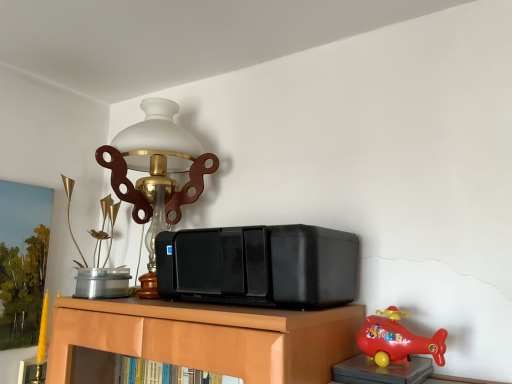
Question: Does black plastic stereo at center appear on the right side of rubberized red helicopter at lower right, the first toy when ordered from front to back?

Choices:
 (A) no
 (B) yes

Answer: (A)

Question: Is the depth of black plastic stereo at center greater than that of rubberized red helicopter at lower right, the second toy viewed from the left?

Choices:
 (A) no
 (B) yes

Answer: (B)

Question: Considering the relative sizes of black plastic stereo at center and rubberized red helicopter at lower right, the first toy when ordered from front to back, in the image provided, is black plastic stereo at center bigger than rubberized red helicopter at lower right, the first toy when ordered from front to back,?

Choices:
 (A) yes
 (B) no

Answer: (A)

Question: Would you consider black plastic stereo at center to be distant from rubberized red helicopter at lower right, the second toy viewed from the back?

Choices:
 (A) yes
 (B) no

Answer: (B)

Question: Is black plastic stereo at center directly adjacent to rubberized red helicopter at lower right, arranged as the 1th toy when viewed from the right?

Choices:
 (A) no
 (B) yes

Answer: (A)

Question: Is black plastic stereo at center in front of or behind matte brass lamp at upper left in the image?

Choices:
 (A) front
 (B) behind

Answer: (A)

Question: Visually, is black plastic stereo at center positioned to the left or to the right of matte brass lamp at upper left?

Choices:
 (A) left
 (B) right

Answer: (B)

Question: From the image's perspective, is black plastic stereo at center positioned above or below matte brass lamp at upper left?

Choices:
 (A) below
 (B) above

Answer: (A)

Question: In terms of size, does black plastic stereo at center appear bigger or smaller than matte brass lamp at upper left?

Choices:
 (A) small
 (B) big

Answer: (A)

Question: From their relative heights in the image, would you say metallic gold vase at upper left, which is the 1th toy in left-to-right order, is taller or shorter than black plastic stereo at center?

Choices:
 (A) tall
 (B) short

Answer: (A)

Question: From a real-world perspective, is metallic gold vase at upper left, which is the 1th toy in left-to-right order, physically located above or below black plastic stereo at center?

Choices:
 (A) below
 (B) above

Answer: (A)

Question: From the image's perspective, is metallic gold vase at upper left, which is counted as the second toy, starting from the right, above or below black plastic stereo at center?

Choices:
 (A) above
 (B) below

Answer: (B)

Question: Is metallic gold vase at upper left, which is the 1th toy in left-to-right order, in front of or behind black plastic stereo at center in the image?

Choices:
 (A) behind
 (B) front

Answer: (A)

Question: Is black plastic stereo at center bigger or smaller than metallic gold vase at upper left, which is the 1th toy in left-to-right order?

Choices:
 (A) big
 (B) small

Answer: (A)

Question: In terms of width, does black plastic stereo at center look wider or thinner when compared to metallic gold vase at upper left, which appears as the first toy when viewed from the back?

Choices:
 (A) wide
 (B) thin

Answer: (A)